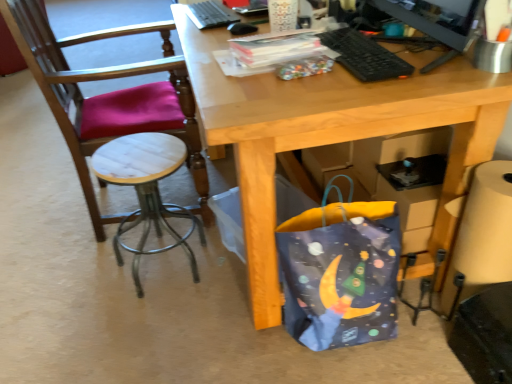
Question: Is black matte mouse at upper center taller than wooden/marble stool at left?

Choices:
 (A) no
 (B) yes

Answer: (A)

Question: Are black matte mouse at upper center and wooden/marble stool at left far apart?

Choices:
 (A) yes
 (B) no

Answer: (B)

Question: Is black matte mouse at upper center positioned before wooden/marble stool at left?

Choices:
 (A) no
 (B) yes

Answer: (A)

Question: Is wooden/marble stool at left at the back of black matte mouse at upper center?

Choices:
 (A) yes
 (B) no

Answer: (B)

Question: Is black matte mouse at upper center positioned beyond the bounds of wooden/marble stool at left?

Choices:
 (A) no
 (B) yes

Answer: (B)

Question: Can you confirm if black matte mouse at upper center is bigger than wooden/marble stool at left?

Choices:
 (A) yes
 (B) no

Answer: (B)

Question: Is the position of black plastic keyboard at upper center, which is the 2th laptop keyboard from left to right, more distant than that of white marble stool at left?

Choices:
 (A) yes
 (B) no

Answer: (B)

Question: Can you confirm if black plastic keyboard at upper center, which is the second laptop keyboard from back to front, is wider than white marble stool at left?

Choices:
 (A) no
 (B) yes

Answer: (A)

Question: Is black plastic keyboard at upper center, which is the 2th laptop keyboard from left to right, at the right side of white marble stool at left?

Choices:
 (A) no
 (B) yes

Answer: (B)

Question: Can you confirm if black plastic keyboard at upper center, the second laptop keyboard positioned from the top, is positioned to the left of white marble stool at left?

Choices:
 (A) yes
 (B) no

Answer: (B)

Question: Is black plastic keyboard at upper center, the second laptop keyboard positioned from the top, in front of white marble stool at left?

Choices:
 (A) yes
 (B) no

Answer: (A)

Question: Can you confirm if black plastic keyboard at upper center, the second laptop keyboard positioned from the top, is shorter than white marble stool at left?

Choices:
 (A) no
 (B) yes

Answer: (B)

Question: Is white marble stool at left oriented away from black matte mouse at upper center?

Choices:
 (A) yes
 (B) no

Answer: (B)